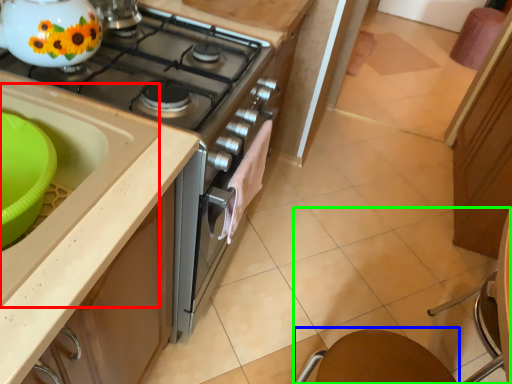
Question: Estimate the real-world distances between objects in this image. Which object is closer to sink (highlighted by a red box), round table (highlighted by a blue box) or chair (highlighted by a green box)?

Choices:
 (A) round table
 (B) chair

Answer: (A)